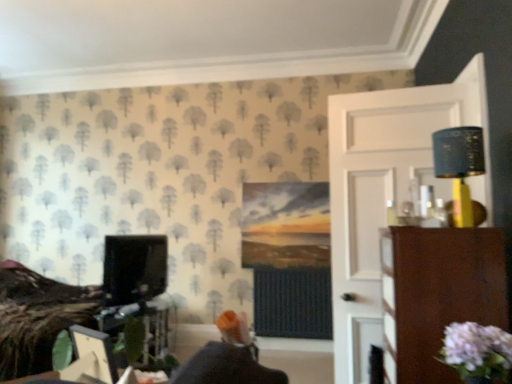
What are the coordinates of `matte black lampshade at upper right` in the screenshot? It's located at (459, 165).

This screenshot has height=384, width=512. Describe the element at coordinates (459, 165) in the screenshot. I see `matte black lampshade at upper right` at that location.

Locate an element on the screen. The image size is (512, 384). pale pink fabric flower at lower right is located at coordinates (477, 350).

Is matte black monitor at left shorter than pale pink fabric flower at lower right?

In fact, matte black monitor at left may be taller than pale pink fabric flower at lower right.

Is point (106, 277) closer or farther from the camera than point (498, 368)?

Clearly, point (106, 277) is more distant from the camera than point (498, 368).

From the image's perspective, which is above, matte black monitor at left or pale pink fabric flower at lower right?

pale pink fabric flower at lower right appears higher in the image.

Looking at this image, in the image, is matte black monitor at left on the left side or the right side of pale pink fabric flower at lower right?

matte black monitor at left is positioned on pale pink fabric flower at lower right's left side.

Are matte black lampshade at upper right and matte black monitor at left far apart?

matte black lampshade at upper right is far away from matte black monitor at left.

Is matte black monitor at left at the back of matte black lampshade at upper right?

No, matte black monitor at left is not at the back of matte black lampshade at upper right.

Does matte black lampshade at upper right have a greater height compared to brown wood dresser at right?

No, matte black lampshade at upper right is not taller than brown wood dresser at right.

Which object is wider, matte black lampshade at upper right or brown wood dresser at right?

With larger width is brown wood dresser at right.

Is the depth of matte black lampshade at upper right greater than that of brown wood dresser at right?

Yes, matte black lampshade at upper right is behind brown wood dresser at right.

Based on the photo, is brown wood dresser at right at the back of matte black lampshade at upper right?

matte black lampshade at upper right is not turned away from brown wood dresser at right.

From the picture: From a real-world perspective, is pale pink fabric flower at lower right positioned over matte black lampshade at upper right based on gravity?

No, from a real-world perspective, pale pink fabric flower at lower right is not over matte black lampshade at upper right

From the image's perspective, which is above, pale pink fabric flower at lower right or matte black lampshade at upper right?

From the image's view, matte black lampshade at upper right is above.

Considering the positions of objects pale pink fabric flower at lower right and matte black lampshade at upper right in the image provided, who is more to the right, pale pink fabric flower at lower right or matte black lampshade at upper right?

From the viewer's perspective, matte black lampshade at upper right appears more on the right side.

Are pale pink fabric flower at lower right and matte black lampshade at upper right far apart?

They are positioned close to each other.

The width and height of the screenshot is (512, 384). I want to click on furniture above the pale pink fabric flower at lower right (from a real-world perspective), so click(436, 294).

Considering the sizes of brown wood dresser at right and pale pink fabric flower at lower right in the image, is brown wood dresser at right wider or thinner than pale pink fabric flower at lower right?

Clearly, brown wood dresser at right has more width compared to pale pink fabric flower at lower right.

In the scene shown: Does brown wood dresser at right lie in front of pale pink fabric flower at lower right?

No, the depth of brown wood dresser at right is greater than that of pale pink fabric flower at lower right.

Could you tell me if brown wood dresser at right is facing pale pink fabric flower at lower right?

No, brown wood dresser at right is not facing towards pale pink fabric flower at lower right.

Would you consider pale pink fabric flower at lower right to be distant from matte black monitor at left?

Yes.

Does pale pink fabric flower at lower right have a greater width compared to matte black monitor at left?

In fact, pale pink fabric flower at lower right might be narrower than matte black monitor at left.

Is pale pink fabric flower at lower right in front of or behind matte black monitor at left in the image?

In the image, pale pink fabric flower at lower right appears in front of matte black monitor at left.

I want to click on flower on the right of matte black monitor at left, so click(x=477, y=350).

From a real-world perspective, is brown wood dresser at right under matte black lampshade at upper right?

Correct, in the physical world, brown wood dresser at right is lower than matte black lampshade at upper right.

Which is less distant, (406, 260) or (461, 160)?

Point (406, 260) is closer to the camera than point (461, 160).

From the image's perspective, is brown wood dresser at right located above or below matte black lampshade at upper right?

Clearly, from the image's perspective, brown wood dresser at right is below matte black lampshade at upper right.

Image resolution: width=512 pixels, height=384 pixels. Identify the location of furniture in front of the matte black lampshade at upper right. (436, 294).

This screenshot has width=512, height=384. What are the coordinates of `flower in front of the matte black monitor at left` in the screenshot? It's located at (477, 350).

You are a GUI agent. You are given a task and a screenshot of the screen. Output one action in this format:
    pyautogui.click(x=<x>, y=<y>)
    Task: Click on the table lamp that appears above the matte black monitor at left (from a real-world perspective)
    The image size is (512, 384).
    Given the screenshot: What is the action you would take?
    pyautogui.click(x=459, y=165)

Which object lies nearer to the anchor point pale pink fabric flower at lower right, matte black monitor at left or matte black lampshade at upper right?

matte black lampshade at upper right is closer to pale pink fabric flower at lower right.

Based on their spatial positions, is pale pink fabric flower at lower right or matte black monitor at left closer to brown wood dresser at right?

Based on the image, pale pink fabric flower at lower right appears to be nearer to brown wood dresser at right.

Considering their positions, is matte black monitor at left positioned closer to pale pink fabric flower at lower right than brown wood dresser at right?

brown wood dresser at right.

Estimate the real-world distances between objects in this image. Which object is further from matte black monitor at left, brown wood dresser at right or matte black lampshade at upper right?

matte black lampshade at upper right lies further to matte black monitor at left than the other object.

Estimate the real-world distances between objects in this image. Which object is further from matte black monitor at left, pale pink fabric flower at lower right or matte black lampshade at upper right?

pale pink fabric flower at lower right lies further to matte black monitor at left than the other object.

From the picture: Looking at the image, which one is located closer to matte black lampshade at upper right, matte black monitor at left or brown wood dresser at right?

brown wood dresser at right is positioned closer to the anchor matte black lampshade at upper right.

From the image, which object appears to be nearer to matte black lampshade at upper right, brown wood dresser at right or pale pink fabric flower at lower right?

Based on the image, brown wood dresser at right appears to be nearer to matte black lampshade at upper right.

Estimate the real-world distances between objects in this image. Which object is closer to pale pink fabric flower at lower right, matte black lampshade at upper right or brown wood dresser at right?

brown wood dresser at right lies closer to pale pink fabric flower at lower right than the other object.

Where is `flower situated between matte black monitor at left and brown wood dresser at right from left to right`? The height and width of the screenshot is (384, 512). flower situated between matte black monitor at left and brown wood dresser at right from left to right is located at coordinates (477, 350).

This screenshot has height=384, width=512. I want to click on furniture between matte black lampshade at upper right and pale pink fabric flower at lower right in the vertical direction, so click(x=436, y=294).

Identify the location of furniture between matte black monitor at left and matte black lampshade at upper right from left to right. (436, 294).

Identify the location of flower between matte black monitor at left and matte black lampshade at upper right from left to right. This screenshot has height=384, width=512. (477, 350).